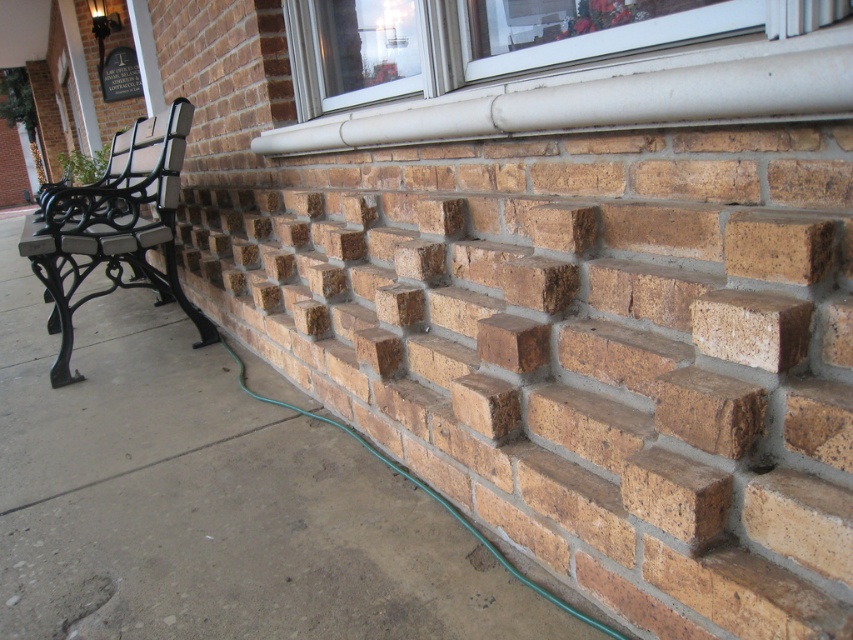
You are a delivery person trying to place a heavy box on the brown brick pavement at lower right and the brown rough brick at upper right. Which surface can better support the weight without breaking?

The brown brick pavement at lower right has a larger size compared to brown rough brick at upper right, so it can better support the weight without breaking.

You are standing at the bottom of the steps leading to the window and want to place a small potted plant exactly at the location of the brown brick pavement at lower right. What are the coordinates where you should place the plant?

The coordinates for the brown brick pavement at lower right are at point (210, 500), so you should place the plant there.

You are a painter standing on the ground, and you need to paint the brown rough brick at upper right. The black wrought iron bench at left is in your way. Can you step over the bench to reach the brick?

The black wrought iron bench at left has a greater height compared to brown rough brick at upper right. Since the bench is taller than the brick, stepping over it may be difficult and could be unsafe. It is recommended to move the bench or use a ladder to access the brick safely.